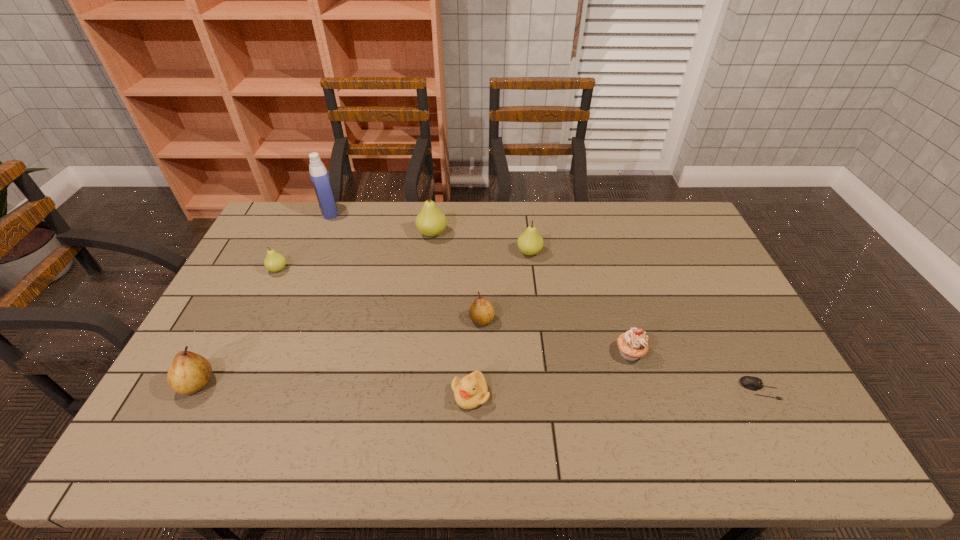
You are a GUI agent. You are given a task and a screenshot of the screen. Output one action in this format:
    pyautogui.click(x=<x>, y=<y>)
    Task: Click on the detergent
    The width and height of the screenshot is (960, 540).
    Given the screenshot: What is the action you would take?
    pyautogui.click(x=319, y=175)

You are a GUI agent. You are given a task and a screenshot of the screen. Output one action in this format:
    pyautogui.click(x=<x>, y=<y>)
    Task: Click on the farthest object
    Image resolution: width=960 pixels, height=540 pixels.
    Given the screenshot: What is the action you would take?
    pyautogui.click(x=319, y=175)

In order to click on the second green pear from right to left in this screenshot , I will do `click(431, 221)`.

The width and height of the screenshot is (960, 540). Find the location of `the biggest green pear`. the biggest green pear is located at coordinates (431, 221).

Locate an element on the screen. This screenshot has height=540, width=960. the fourth nearest pear is located at coordinates (530, 242).

I want to click on the second smallest green pear, so click(x=530, y=242).

This screenshot has width=960, height=540. Find the location of `the nearest pear`. the nearest pear is located at coordinates (189, 372).

This screenshot has height=540, width=960. What are the coordinates of `the left brown pear` in the screenshot? It's located at (189, 372).

Identify the location of the nearest green pear. (274, 262).

Where is `the fourth farthest object`? the fourth farthest object is located at coordinates (274, 262).